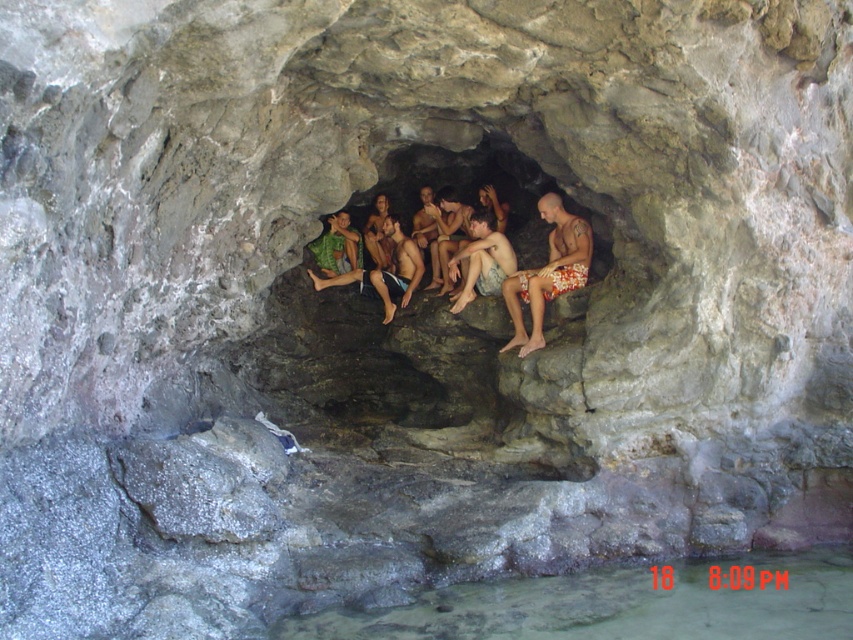
Does green fabric towel at center have a greater width compared to camouflage shorts at center?

Yes, green fabric towel at center is wider than camouflage shorts at center.

Is point (357, 268) positioned before point (492, 243)?

No, it is behind (492, 243).

What are the coordinates of `green fabric towel at center` in the screenshot? It's located at (386, 272).

Is floral print shorts at center closer to camera compared to camouflage shorts at center?

Yes, floral print shorts at center is closer to the viewer.

Is floral print shorts at center wider than camouflage shorts at center?

Correct, the width of floral print shorts at center exceeds that of camouflage shorts at center.

Is point (567, 228) in front of point (498, 268)?

Yes, it is.

Image resolution: width=853 pixels, height=640 pixels. In order to click on floral print shorts at center in this screenshot , I will do `click(548, 273)`.

Does clear water at lower center have a greater height compared to camouflage shorts at center?

No, clear water at lower center is not taller than camouflage shorts at center.

Does clear water at lower center appear on the left side of camouflage shorts at center?

Incorrect, clear water at lower center is not on the left side of camouflage shorts at center.

The width and height of the screenshot is (853, 640). Identify the location of clear water at lower center. (616, 604).

I want to click on clear water at lower center, so click(x=616, y=604).